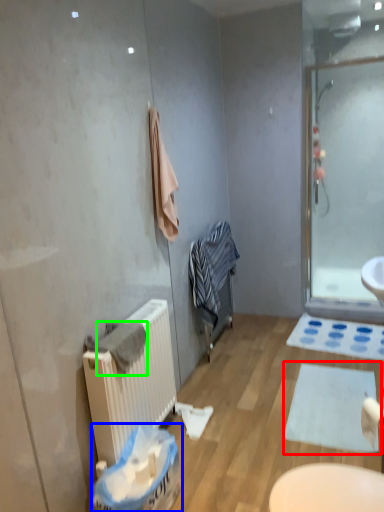
Question: Based on their relative distances, which object is farther from bath mat (highlighted by a red box)? Choose from laundry basket (highlighted by a blue box) and bath towel (highlighted by a green box).

Choices:
 (A) laundry basket
 (B) bath towel

Answer: (B)